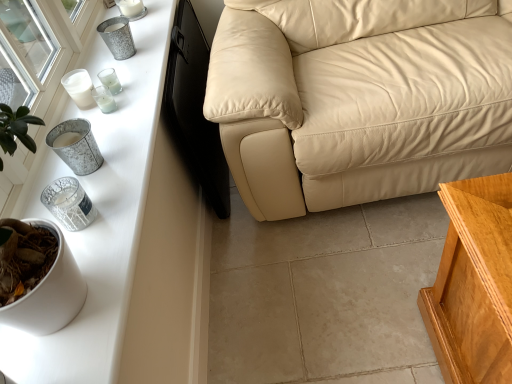
The height and width of the screenshot is (384, 512). Identify the location of white glossy table at left. (131, 240).

Measure the distance between point (98, 76) and camera.

Point (98, 76) and camera are 4.42 feet apart from each other.

Measure the distance between point (75, 167) and camera.

The depth of point (75, 167) is 3.28 feet.

Locate an element on the screen. This screenshot has height=384, width=512. metallic silver candle holder at left, the second candle holder in the bottom-to-top sequence is located at coordinates (76, 146).

What do you see at coordinates (104, 99) in the screenshot?
I see `metallic glass candle at upper left, the fourth candle holder when ordered from top to bottom` at bounding box center [104, 99].

Find the location of a particular element. The width and height of the screenshot is (512, 384). white glossy table at left is located at coordinates (131, 240).

Is the position of white glossy table at left less distant than that of metallic candle holder at upper left, the 3th candle holder viewed from the top?

Yes, white glossy table at left is closer to the camera.

From a real-world perspective, is white glossy table at left physically located above or below metallic candle holder at upper left, the 4th candle holder when ordered from bottom to top?

From a real-world perspective, white glossy table at left is physically below metallic candle holder at upper left, the 4th candle holder when ordered from bottom to top.

Considering the sizes of objects white glossy table at left and metallic candle holder at upper left, the 3th candle holder viewed from the top, in the image provided, who is wider, white glossy table at left or metallic candle holder at upper left, the 3th candle holder viewed from the top,?

white glossy table at left.

Who is bigger, white glossy table at left or metallic candle holder at upper left, the 4th candle holder when ordered from bottom to top?

Bigger between the two is white glossy table at left.

Which object is further away from the camera, metallic glass candle holder at upper left, which is the second candle holder from top to bottom, or beige leather couch at center?

metallic glass candle holder at upper left, which is the second candle holder from top to bottom, is further from the camera.

From the image's perspective, is metallic glass candle holder at upper left, which is the second candle holder from top to bottom, located above or below beige leather couch at center?

Based on their image positions, metallic glass candle holder at upper left, which is the second candle holder from top to bottom, is located beneath beige leather couch at center.

Could you tell me if metallic glass candle holder at upper left, which is the second candle holder from top to bottom, is turned towards beige leather couch at center?

Yes, metallic glass candle holder at upper left, which is the second candle holder from top to bottom, is facing beige leather couch at center.

Looking at their sizes, would you say beige leather couch at center is wider or thinner than metallic glass candle holder at upper left, which is the second candle holder from top to bottom?

Clearly, beige leather couch at center has more width compared to metallic glass candle holder at upper left, which is the second candle holder from top to bottom.

Is beige leather couch at center positioned beyond the bounds of metallic glass candle holder at upper left, the fifth candle holder when ordered from bottom to top?

Indeed, beige leather couch at center is completely outside metallic glass candle holder at upper left, the fifth candle holder when ordered from bottom to top.

This screenshot has width=512, height=384. In order to click on the 2nd candle holder positioned below the beige leather couch at center (from the image's perspective) in this screenshot , I will do `click(110, 80)`.

From the image's perspective, which object appears higher, white glossy table at left or metallic glass candle holder at upper left, the fifth candle holder when ordered from bottom to top?

From the image's view, metallic glass candle holder at upper left, the fifth candle holder when ordered from bottom to top, is above.

Can you confirm if white glossy table at left is thinner than metallic glass candle holder at upper left, the fifth candle holder when ordered from bottom to top?

In fact, white glossy table at left might be wider than metallic glass candle holder at upper left, the fifth candle holder when ordered from bottom to top.

In the scene shown: From a real-world perspective, is white glossy table at left above or below metallic glass candle holder at upper left, which is the second candle holder from top to bottom?

white glossy table at left is situated lower than metallic glass candle holder at upper left, which is the second candle holder from top to bottom, in the real world.

Which object is positioned more to the left, white glossy table at left or metallic glass candle holder at upper left, which is the second candle holder from top to bottom?

From the viewer's perspective, metallic glass candle holder at upper left, which is the second candle holder from top to bottom, appears more on the left side.

Does metallic wire candle holder at left, which is the 1th candle holder from bottom to top, have a lesser height compared to metallic silver candle holder at left, the second candle holder in the bottom-to-top sequence?

Indeed, metallic wire candle holder at left, which is the 1th candle holder from bottom to top, has a lesser height compared to metallic silver candle holder at left, the second candle holder in the bottom-to-top sequence.

The width and height of the screenshot is (512, 384). I want to click on candle holder in front of the metallic silver candle holder at left, the second candle holder in the bottom-to-top sequence, so click(69, 203).

Looking at the image, does metallic wire candle holder at left, acting as the sixth candle holder starting from the top, seem bigger or smaller compared to metallic silver candle holder at left, the second candle holder in the bottom-to-top sequence?

Clearly, metallic wire candle holder at left, acting as the sixth candle holder starting from the top, is smaller in size than metallic silver candle holder at left, the second candle holder in the bottom-to-top sequence.

Is metallic wire candle holder at left, acting as the sixth candle holder starting from the top, far from metallic silver candle holder at left, the second candle holder in the bottom-to-top sequence?

metallic wire candle holder at left, acting as the sixth candle holder starting from the top, is near metallic silver candle holder at left, the second candle holder in the bottom-to-top sequence, not far away.

Can you confirm if metallic silver candle holder at left, which is the 5th candle holder from top to bottom, is smaller than beige leather couch at center?

Correct, metallic silver candle holder at left, which is the 5th candle holder from top to bottom, occupies less space than beige leather couch at center.

Is metallic silver candle holder at left, which is the 5th candle holder from top to bottom, taller or shorter than beige leather couch at center?

Clearly, metallic silver candle holder at left, which is the 5th candle holder from top to bottom, is shorter compared to beige leather couch at center.

Can you tell me how much metallic silver candle holder at left, which is the 5th candle holder from top to bottom, and beige leather couch at center differ in facing direction?

They differ by 85.9 degrees in their facing directions.

Is point (91, 145) behind point (315, 175)?

No, it is not.

What are the coordinates of `the 3rd candle holder in front of the metallic glass candle holder at upper left, the fifth candle holder when ordered from bottom to top, starting your count from the anchor` in the screenshot? It's located at (76, 146).

Between metallic glass candle holder at upper left, which is the second candle holder from top to bottom, and metallic silver candle holder at left, the second candle holder in the bottom-to-top sequence, which one has less height?

metallic glass candle holder at upper left, which is the second candle holder from top to bottom.

Which of these two, metallic glass candle holder at upper left, the fifth candle holder when ordered from bottom to top, or metallic silver candle holder at left, which is the 5th candle holder from top to bottom, is wider?

Wider between the two is metallic silver candle holder at left, which is the 5th candle holder from top to bottom.

Is point (103, 83) closer or farther from the camera than point (90, 148)?

Clearly, point (103, 83) is more distant from the camera than point (90, 148).

Locate an element on the screen. The height and width of the screenshot is (384, 512). table that appears in front of the metallic candle holder at upper left, the 4th candle holder when ordered from bottom to top is located at coordinates (131, 240).

You are a GUI agent. You are given a task and a screenshot of the screen. Output one action in this format:
    pyautogui.click(x=<x>, y=<y>)
    Task: Click on the studio couch below the metallic glass candle holder at upper left, the fifth candle holder when ordered from bottom to top (from a real-world perspective)
    
    Given the screenshot: What is the action you would take?
    pyautogui.click(x=359, y=98)

Based on their spatial positions, is metallic textured candle holder at upper left, which ranks as the 1th candle holder in top-to-bottom order, or beige leather couch at center further from metallic wire candle holder at left, which is the 1th candle holder from bottom to top?

beige leather couch at center.

Which object lies nearer to the anchor point metallic wire candle holder at left, which is the 1th candle holder from bottom to top, metallic candle holder at upper left, the 4th candle holder when ordered from bottom to top, or metallic glass candle at upper left, which appears as the 3th candle holder when ordered from the bottom?

Result: metallic glass candle at upper left, which appears as the 3th candle holder when ordered from the bottom, is closer to metallic wire candle holder at left, which is the 1th candle holder from bottom to top.

Looking at the image, which one is located further to beige leather couch at center, metallic candle holder at upper left, the 3th candle holder viewed from the top, or metallic silver candle holder at left, the second candle holder in the bottom-to-top sequence?

metallic silver candle holder at left, the second candle holder in the bottom-to-top sequence, is further to beige leather couch at center.

From the image, which object appears to be nearer to metallic glass candle at upper left, the fourth candle holder when ordered from top to bottom, metallic candle holder at upper left, the 3th candle holder viewed from the top, or beige leather couch at center?

metallic candle holder at upper left, the 3th candle holder viewed from the top, lies closer to metallic glass candle at upper left, the fourth candle holder when ordered from top to bottom, than the other object.

Considering their positions, is metallic textured candle holder at upper left, acting as the sixth candle holder starting from the bottom, positioned further to metallic glass candle holder at upper left, which is the second candle holder from top to bottom, than beige leather couch at center?

The object further to metallic glass candle holder at upper left, which is the second candle holder from top to bottom, is beige leather couch at center.

Estimate the real-world distances between objects in this image. Which object is closer to metallic textured candle holder at upper left, which ranks as the 1th candle holder in top-to-bottom order, metallic wire candle holder at left, acting as the sixth candle holder starting from the top, or beige leather couch at center?

Among the two, metallic wire candle holder at left, acting as the sixth candle holder starting from the top, is located nearer to metallic textured candle holder at upper left, which ranks as the 1th candle holder in top-to-bottom order.

Which object lies nearer to the anchor point metallic glass candle at upper left, the fourth candle holder when ordered from top to bottom, white glossy table at left or metallic glass candle holder at upper left, which is the second candle holder from top to bottom?

metallic glass candle holder at upper left, which is the second candle holder from top to bottom.

When comparing their distances from metallic candle holder at upper left, the 4th candle holder when ordered from bottom to top, does metallic glass candle at upper left, the fourth candle holder when ordered from top to bottom, or metallic glass candle holder at upper left, which is the second candle holder from top to bottom, seem further?

metallic glass candle holder at upper left, which is the second candle holder from top to bottom, is further to metallic candle holder at upper left, the 4th candle holder when ordered from bottom to top.

This screenshot has width=512, height=384. I want to click on table between metallic glass candle holder at upper left, which is the second candle holder from top to bottom, and beige leather couch at center from left to right, so click(x=131, y=240).

Identify the location of candle holder between metallic silver candle holder at left, which is the 5th candle holder from top to bottom, and metallic candle holder at upper left, the 4th candle holder when ordered from bottom to top, along the z-axis. (104, 99).

At what (x,y) coordinates should I click in order to perform the action: click on candle holder between metallic wire candle holder at left, which is the 1th candle holder from bottom to top, and metallic glass candle at upper left, which appears as the 3th candle holder when ordered from the bottom, in the front-back direction. Please return your answer as a coordinate pair (x, y). Looking at the image, I should click on (76, 146).

In order to click on candle holder situated between metallic glass candle at upper left, the fourth candle holder when ordered from top to bottom, and beige leather couch at center from left to right in this screenshot , I will do `click(69, 203)`.